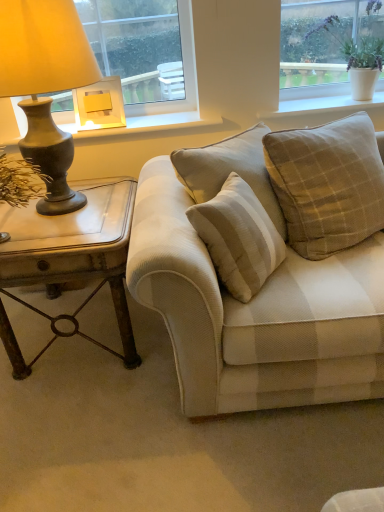
This screenshot has width=384, height=512. What do you see at coordinates (238, 238) in the screenshot? I see `beige textured pillow at center, placed as the 2th pillow when sorted from right to left` at bounding box center [238, 238].

What do you see at coordinates (184, 73) in the screenshot? I see `yellow fabric at upper left, arranged as the second window when viewed from the right` at bounding box center [184, 73].

How much space does yellow fabric at upper left, arranged as the second window when viewed from the right, occupy horizontally?

The width of yellow fabric at upper left, arranged as the second window when viewed from the right, is 4.61 inches.

Describe the element at coordinates (321, 45) in the screenshot. I see `white ceramic pot at upper right, which appears as the first window when viewed from the right` at that location.

I want to click on matte bronze lamp at left, positioned as the 2th lamp in back-to-front order, so click(x=45, y=85).

Identify the location of beige textured couch at center. The image size is (384, 512). (255, 314).

What do you see at coordinates (70, 261) in the screenshot?
I see `rustic wood side table at left` at bounding box center [70, 261].

Where is `beige textured pillow at center, placed as the 2th pillow when sorted from right to left`? This screenshot has width=384, height=512. beige textured pillow at center, placed as the 2th pillow when sorted from right to left is located at coordinates (238, 238).

Which object is further away from the camera, beige textured pillow at center, the 1th pillow viewed from the left, or beige checkered pillow at upper right, which ranks as the second pillow in left-to-right order?

Positioned behind is beige checkered pillow at upper right, which ranks as the second pillow in left-to-right order.

Is the surface of beige textured pillow at center, the 1th pillow viewed from the left, in direct contact with beige checkered pillow at upper right, the first pillow when ordered from right to left?

No, beige textured pillow at center, the 1th pillow viewed from the left, is not making contact with beige checkered pillow at upper right, the first pillow when ordered from right to left.

Consider the image. Between beige textured pillow at center, placed as the 2th pillow when sorted from right to left, and beige checkered pillow at upper right, the first pillow when ordered from right to left, which one has smaller width?

beige checkered pillow at upper right, the first pillow when ordered from right to left.

Is beige textured pillow at center, the 1th pillow viewed from the left, to the left or to the right of beige checkered pillow at upper right, which ranks as the second pillow in left-to-right order, in the image?

In the image, beige textured pillow at center, the 1th pillow viewed from the left, appears on the left side of beige checkered pillow at upper right, which ranks as the second pillow in left-to-right order.

From the image's perspective, would you say rustic wood side table at left is shown under beige textured pillow at center, placed as the 2th pillow when sorted from right to left?

Yes, from the image's perspective, rustic wood side table at left is beneath beige textured pillow at center, placed as the 2th pillow when sorted from right to left.

In the scene shown: Who is bigger, rustic wood side table at left or beige textured pillow at center, the 1th pillow viewed from the left?

rustic wood side table at left.

Is rustic wood side table at left facing away from beige textured pillow at center, placed as the 2th pillow when sorted from right to left?

That's not correct — rustic wood side table at left is not looking away from beige textured pillow at center, placed as the 2th pillow when sorted from right to left.

Considering the positions of objects rustic wood side table at left and beige textured pillow at center, the 1th pillow viewed from the left, in the image provided, who is more to the right, rustic wood side table at left or beige textured pillow at center, the 1th pillow viewed from the left,?

beige textured pillow at center, the 1th pillow viewed from the left.

Is rustic wood side table at left completely or partially outside of beige textured couch at center?

Yes, rustic wood side table at left is outside of beige textured couch at center.

The height and width of the screenshot is (512, 384). In order to click on table that is behind the beige textured couch at center in this screenshot , I will do `click(70, 261)`.

Which is behind, point (106, 274) or point (276, 326)?

The point (106, 274) is farther.

From the image's perspective, between rustic wood side table at left and beige checkered pillow at upper right, which ranks as the second pillow in left-to-right order, who is located below?

rustic wood side table at left appears lower in the image.

In the scene shown: From a real-world perspective, between rustic wood side table at left and beige checkered pillow at upper right, the first pillow when ordered from right to left, who is vertically lower?

rustic wood side table at left.

From the picture: Considering the positions of objects rustic wood side table at left and beige checkered pillow at upper right, the first pillow when ordered from right to left, in the image provided, who is behind, rustic wood side table at left or beige checkered pillow at upper right, the first pillow when ordered from right to left,?

rustic wood side table at left.

Which object is further away from the camera, beige checkered pillow at upper right, which ranks as the second pillow in left-to-right order, or matte bronze lamp at left, marked as the 1th lamp in a front-to-back arrangement?

beige checkered pillow at upper right, which ranks as the second pillow in left-to-right order, is further away from the camera.

From a real-world perspective, is beige checkered pillow at upper right, the first pillow when ordered from right to left, below matte bronze lamp at left, marked as the 1th lamp in a front-to-back arrangement?

Yes, from a real-world perspective, beige checkered pillow at upper right, the first pillow when ordered from right to left, is below matte bronze lamp at left, marked as the 1th lamp in a front-to-back arrangement.

In the scene shown: Is beige checkered pillow at upper right, the first pillow when ordered from right to left, situated inside matte bronze lamp at left, marked as the 1th lamp in a front-to-back arrangement, or outside?

beige checkered pillow at upper right, the first pillow when ordered from right to left, is located beyond the bounds of matte bronze lamp at left, marked as the 1th lamp in a front-to-back arrangement.

Is matte bronze lamp at left, marked as the 1th lamp in a front-to-back arrangement, inside the boundaries of yellow fabric at upper left, the 1th window in the left-to-right sequence, or outside?

matte bronze lamp at left, marked as the 1th lamp in a front-to-back arrangement, exists outside the volume of yellow fabric at upper left, the 1th window in the left-to-right sequence.

Considering the relative positions of matte bronze lamp at left, positioned as the 2th lamp in back-to-front order, and yellow fabric at upper left, the 1th window in the left-to-right sequence, in the image provided, is matte bronze lamp at left, positioned as the 2th lamp in back-to-front order, in front of yellow fabric at upper left, the 1th window in the left-to-right sequence,?

Yes, it is.

In order to click on the 1st window to the right of the matte bronze lamp at left, positioned as the 2th lamp in back-to-front order, counting from the anchor's position in this screenshot , I will do click(184, 73).

From a real-world perspective, which is physically above, matte bronze lamp at left, marked as the 1th lamp in a front-to-back arrangement, or yellow fabric at upper left, arranged as the second window when viewed from the right?

yellow fabric at upper left, arranged as the second window when viewed from the right, from a real-world perspective.

Considering the relative positions of beige textured couch at center and matte wood window sill at upper center in the image provided, is beige textured couch at center to the right of matte wood window sill at upper center from the viewer's perspective?

Yes.

Does beige textured couch at center have a larger size compared to matte wood window sill at upper center?

Correct, beige textured couch at center is larger in size than matte wood window sill at upper center.

Is beige textured couch at center facing towards matte wood window sill at upper center?

No, beige textured couch at center is not oriented towards matte wood window sill at upper center.

Can we say beige textured couch at center lies outside matte wood window sill at upper center?

Yes, beige textured couch at center is located beyond the bounds of matte wood window sill at upper center.

This screenshot has height=512, width=384. I want to click on pillow that appears below the beige checkered pillow at upper right, which ranks as the second pillow in left-to-right order (from a real-world perspective), so click(238, 238).

At what (x,y) coordinates should I click in order to perform the action: click on table behind the beige textured pillow at center, placed as the 2th pillow when sorted from right to left. Please return your answer as a coordinate pair (x, y). The height and width of the screenshot is (512, 384). Looking at the image, I should click on (70, 261).

Considering their positions, is beige textured pillow at center, the 1th pillow viewed from the left, positioned closer to yellow fabric at upper left, the 1th window in the left-to-right sequence, than matte gold lampshade at upper left, the first lamp viewed from the back?

Among the two, matte gold lampshade at upper left, the first lamp viewed from the back, is located nearer to yellow fabric at upper left, the 1th window in the left-to-right sequence.

Looking at the image, which one is located closer to beige checkered pillow at upper right, the first pillow when ordered from right to left, white ceramic pot at upper right, which appears as the first window when viewed from the right, or rustic wood side table at left?

Result: white ceramic pot at upper right, which appears as the first window when viewed from the right, is positioned closer to the anchor beige checkered pillow at upper right, the first pillow when ordered from right to left.

Looking at the image, which one is located further to matte bronze lamp at left, marked as the 1th lamp in a front-to-back arrangement, beige checkered pillow at upper right, which ranks as the second pillow in left-to-right order, or white ceramic pot at upper right, positioned as the 2th window in left-to-right order?

white ceramic pot at upper right, positioned as the 2th window in left-to-right order, is positioned further to the anchor matte bronze lamp at left, marked as the 1th lamp in a front-to-back arrangement.

Based on their spatial positions, is matte wood window sill at upper center or beige textured couch at center closer to yellow fabric at upper left, arranged as the second window when viewed from the right?

Based on the image, matte wood window sill at upper center appears to be nearer to yellow fabric at upper left, arranged as the second window when viewed from the right.

Estimate the real-world distances between objects in this image. Which object is closer to beige textured couch at center, beige textured pillow at center, the 1th pillow viewed from the left, or yellow fabric at upper left, arranged as the second window when viewed from the right?

beige textured pillow at center, the 1th pillow viewed from the left.

Looking at the image, which one is located closer to yellow fabric at upper left, the 1th window in the left-to-right sequence, rustic wood side table at left or beige textured pillow at center, the 1th pillow viewed from the left?

rustic wood side table at left.

Based on their spatial positions, is matte bronze lamp at left, positioned as the 2th lamp in back-to-front order, or yellow fabric at upper left, the 1th window in the left-to-right sequence, further from beige checkered pillow at upper right, which ranks as the second pillow in left-to-right order?

matte bronze lamp at left, positioned as the 2th lamp in back-to-front order.

When comparing their distances from matte wood window sill at upper center, does beige textured couch at center or white ceramic pot at upper right, which appears as the first window when viewed from the right, seem further?

Based on the image, beige textured couch at center appears to be further to matte wood window sill at upper center.

This screenshot has width=384, height=512. What are the coordinates of `table between matte bronze lamp at left, positioned as the 2th lamp in back-to-front order, and matte wood window sill at upper center in the front-back direction` in the screenshot? It's located at (70, 261).

Where is `studio couch situated between matte gold lampshade at upper left, the first lamp viewed from the back, and white ceramic pot at upper right, positioned as the 2th window in left-to-right order, from left to right`? The height and width of the screenshot is (512, 384). studio couch situated between matte gold lampshade at upper left, the first lamp viewed from the back, and white ceramic pot at upper right, positioned as the 2th window in left-to-right order, from left to right is located at coordinates point(255,314).

You are a GUI agent. You are given a task and a screenshot of the screen. Output one action in this format:
    pyautogui.click(x=<x>, y=<y>)
    Task: Click on the window sill between rustic wood side table at left and beige checkered pillow at upper right, which ranks as the second pillow in left-to-right order, from left to right
    Image resolution: width=384 pixels, height=512 pixels.
    Given the screenshot: What is the action you would take?
    pyautogui.click(x=155, y=125)

Locate an element on the screen. This screenshot has height=512, width=384. lamp between matte bronze lamp at left, marked as the 1th lamp in a front-to-back arrangement, and beige textured couch at center, in the horizontal direction is located at coordinates (99, 105).